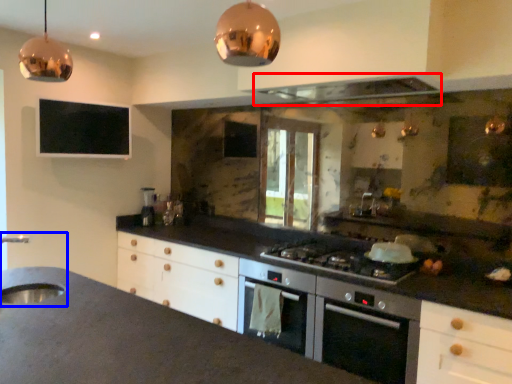
Question: Which point is closer to the camera, exhaust hood (highlighted by a red box) or sink (highlighted by a blue box)?

Choices:
 (A) exhaust hood
 (B) sink

Answer: (B)